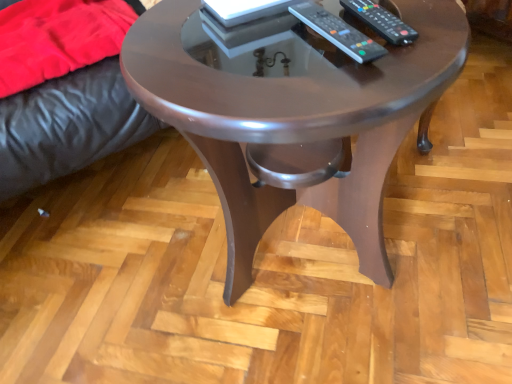
This screenshot has width=512, height=384. Identify the location of free spot to the right of black plastic remote at upper right, marked as the 1th remote in a right-to-left arrangement. (424, 13).